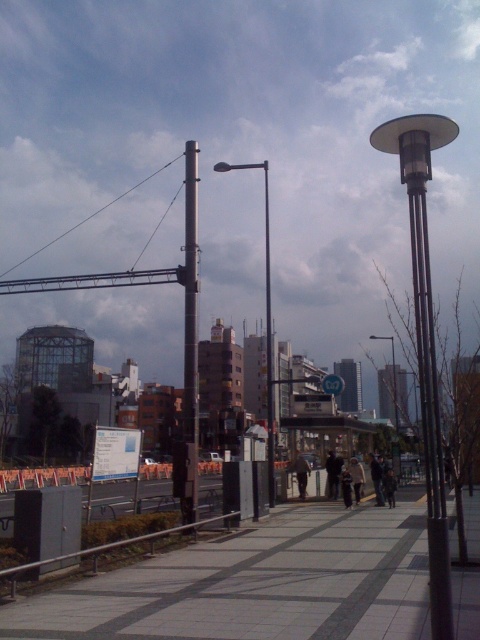
Does metallic gray pole at right lie behind metallic gray streetlight at center?

That is False.

Who is shorter, metallic gray pole at right or metallic gray streetlight at center?

metallic gray pole at right

Does point (448, 628) lie behind point (395, 371)?

No, it is not.

This screenshot has width=480, height=640. What are the coordinates of `metallic gray pole at right` in the screenshot? It's located at (424, 337).

The width and height of the screenshot is (480, 640). In order to click on metallic pole at center in this screenshot , I will do `click(265, 324)`.

Can you confirm if metallic pole at center is shorter than light brown leather jacket at center?

No.

Does point (265, 308) come farther from viewer compared to point (360, 465)?

Yes, point (265, 308) is farther from viewer.

Where is `metallic pole at center`? metallic pole at center is located at coordinates (265, 324).

Is dark brown leather jacket at center positioned in front of light brown leather jacket at center?

No.

Between dark brown leather jacket at center and light brown leather jacket at center, which one has more height?

light brown leather jacket at center

Which is behind, point (299, 474) or point (359, 493)?

The point (299, 474) is more distant.

Locate an element on the screen. The height and width of the screenshot is (640, 480). dark brown leather jacket at center is located at coordinates (300, 472).